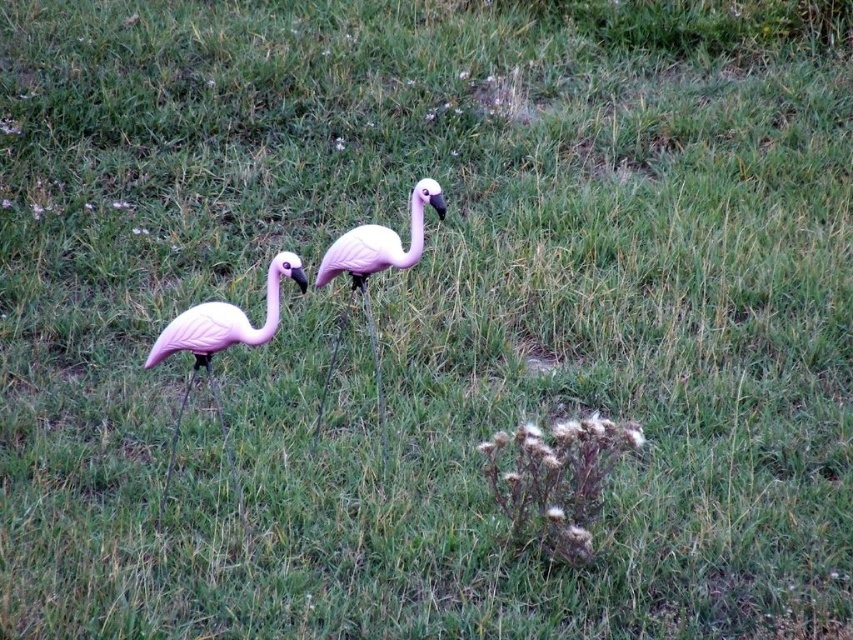
Looking at this image, you are a gardener who wants to arrange the pink matte plastic flamingo at left and the matte pink flamingo at center in a way that the smaller one is placed closer to the thistles. Which flamingo should you move to be closer to the thistles?

The pink matte plastic flamingo at left is smaller than the matte pink flamingo at center, so you should move the pink matte plastic flamingo at left closer to the thistles.

You are a gardener who wants to place a new decorative item between the pink matte plastic flamingo at left and the matte pink flamingo at center. The item is 28 inches long. Will it fit exactly between them without overlapping either flamingo?

The distance between the pink matte plastic flamingo at left and the matte pink flamingo at center is 27.99 inches. Since the item is 28 inches long, it will not fit exactly and will overlap both flamingos slightly.

You are standing at a point and want to place a 3.5 meter long fence between you and the point at point (239,506). Will the fence reach that point?

The distance between you and point (239,506) is 4.84 meters. The fence is only 3.5 meters long, so it will not reach the point.